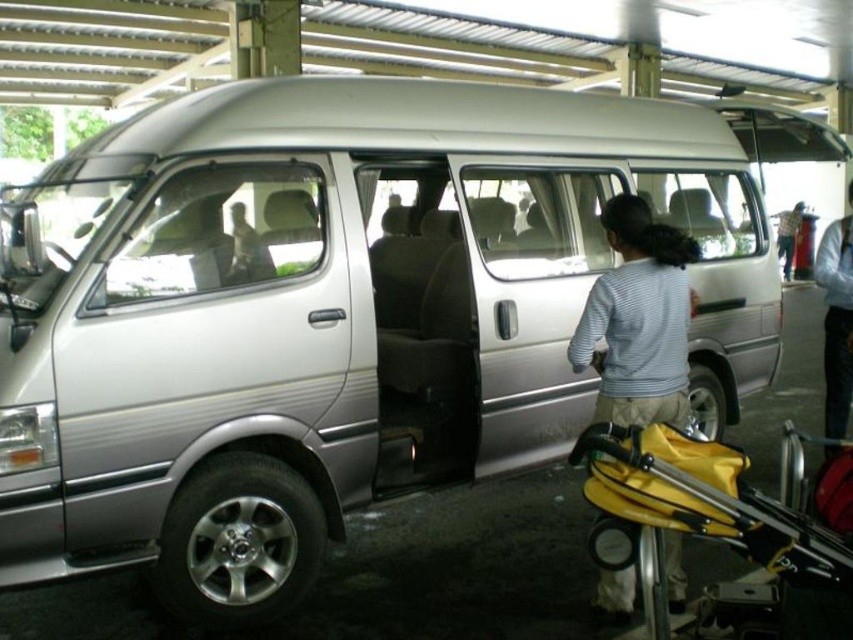
Question: Estimate the real-world distances between objects in this image. Which object is closer to the light blue sweater at center?

Choices:
 (A) yellow plastic baby carriage at lower right
 (B) dark blue jeans at right

Answer: (B)

Question: Does yellow plastic baby carriage at lower right appear over striped fabric shirt at center?

Choices:
 (A) no
 (B) yes

Answer: (A)

Question: Among these points, which one is nearest to the camera?

Choices:
 (A) (782, 211)
 (B) (647, 605)
 (C) (685, 426)

Answer: (B)

Question: Which point appears farthest from the camera in this image?

Choices:
 (A) (784, 225)
 (B) (614, 579)
 (C) (844, 396)
 (D) (804, 552)

Answer: (A)

Question: Does yellow plastic baby carriage at lower right have a larger size compared to dark blue jeans at right?

Choices:
 (A) yes
 (B) no

Answer: (B)

Question: Does striped fabric shirt at center appear under light blue sweater at center?

Choices:
 (A) no
 (B) yes

Answer: (B)